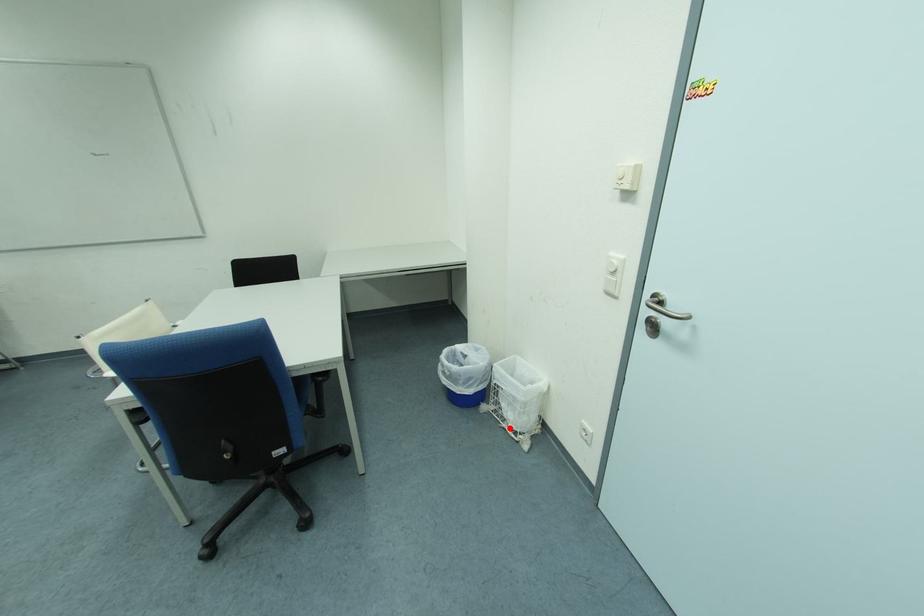
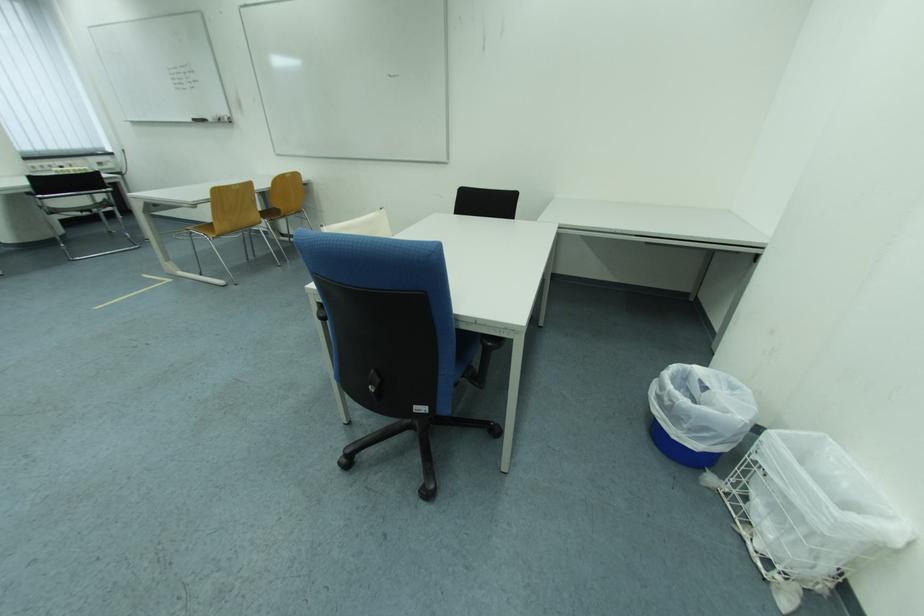
In the second image, find the point that corresponds to the highlighted location in the first image.

(745, 532)